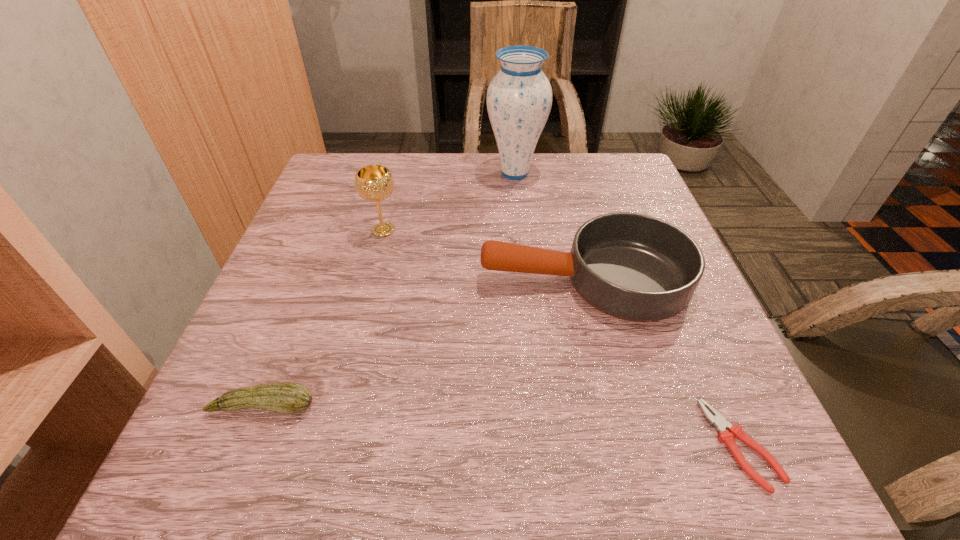
Image resolution: width=960 pixels, height=540 pixels. Find the location of `the farthest object`. the farthest object is located at coordinates (519, 98).

Where is `vase`? vase is located at coordinates (519, 98).

At what (x,y) coordinates should I click in order to perform the action: click on the fourth shortest object. Please return your answer as a coordinate pair (x, y). The image size is (960, 540). Looking at the image, I should click on (374, 183).

Locate an element on the screen. The width and height of the screenshot is (960, 540). the third shortest object is located at coordinates (635, 267).

Locate an element on the screen. zucchini is located at coordinates (283, 397).

Image resolution: width=960 pixels, height=540 pixels. I want to click on the shortest object, so click(x=734, y=431).

You are a GUI agent. You are given a task and a screenshot of the screen. Output one action in this format:
    pyautogui.click(x=<x>, y=<y>)
    Task: Click on the vacant area situated 0.350m on the left of the farthest object
    
    Given the screenshot: What is the action you would take?
    pyautogui.click(x=355, y=173)

What are the coordinates of `blank area located on the back of the chalice` in the screenshot? It's located at (395, 187).

Locate an element on the screen. The height and width of the screenshot is (540, 960). free region located on the handle side of the pan is located at coordinates (445, 279).

At what (x,y) coordinates should I click in order to perform the action: click on vacant space situated on the handle side of the pan. Please return your answer as a coordinate pair (x, y). The image size is (960, 540). Looking at the image, I should click on (426, 279).